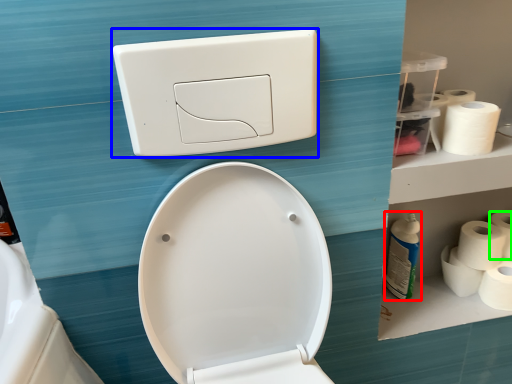
Question: Considering the real-world distances, which object is farthest from cleaning product (highlighted by a red box)? light switch (highlighted by a blue box) or toilet paper (highlighted by a green box)?

Choices:
 (A) light switch
 (B) toilet paper

Answer: (A)